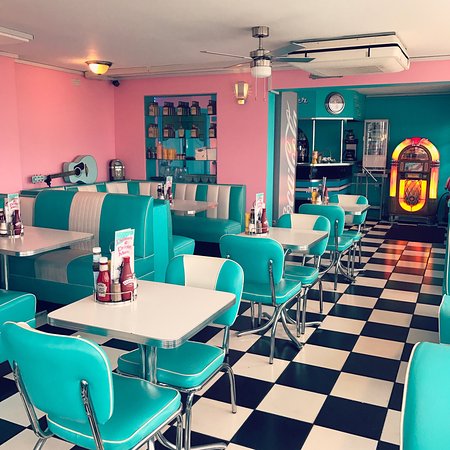
The image size is (450, 450). I want to click on clock, so click(335, 103).